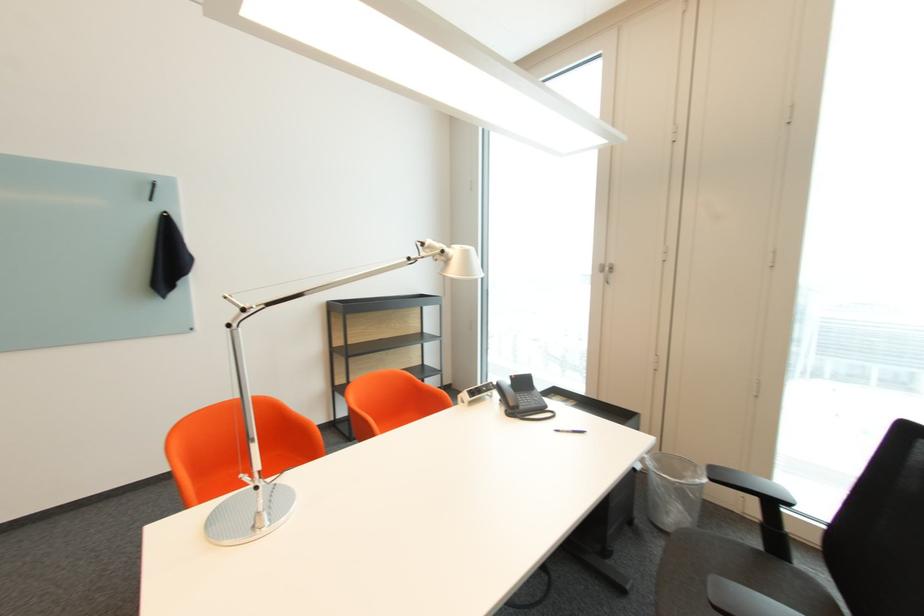
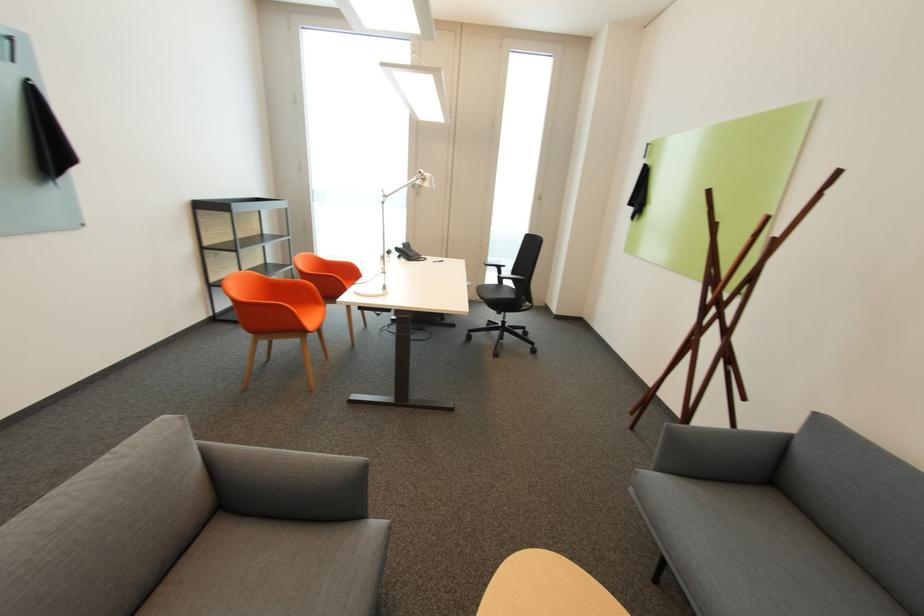
The point at (517, 411) is marked in the first image. Where is the corresponding point in the second image?

(419, 259)